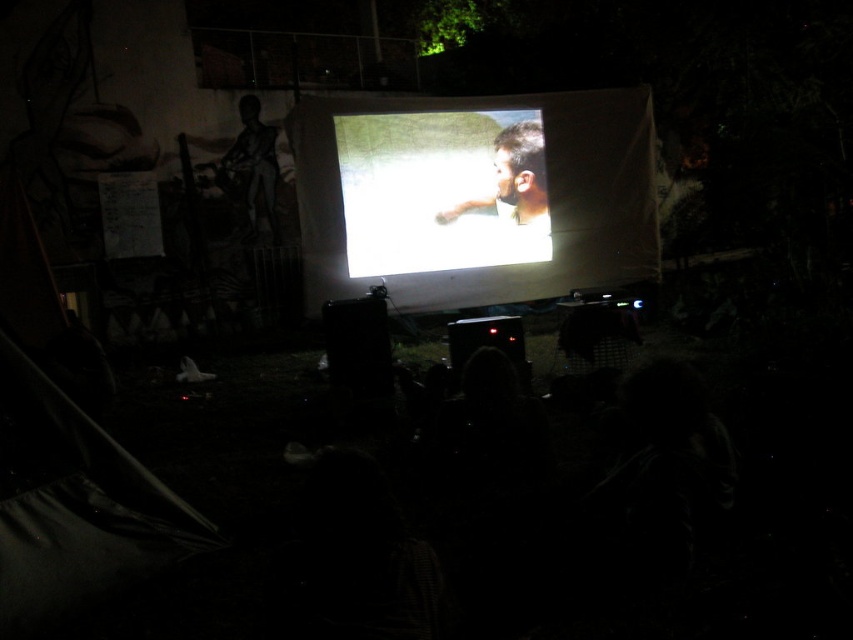
Does bright white screen at center have a larger size compared to smooth skin face at center?

Yes.

Is point (508, 157) farther from viewer compared to point (500, 253)?

No, it is not.

What are the coordinates of `bright white screen at center` in the screenshot? It's located at (440, 189).